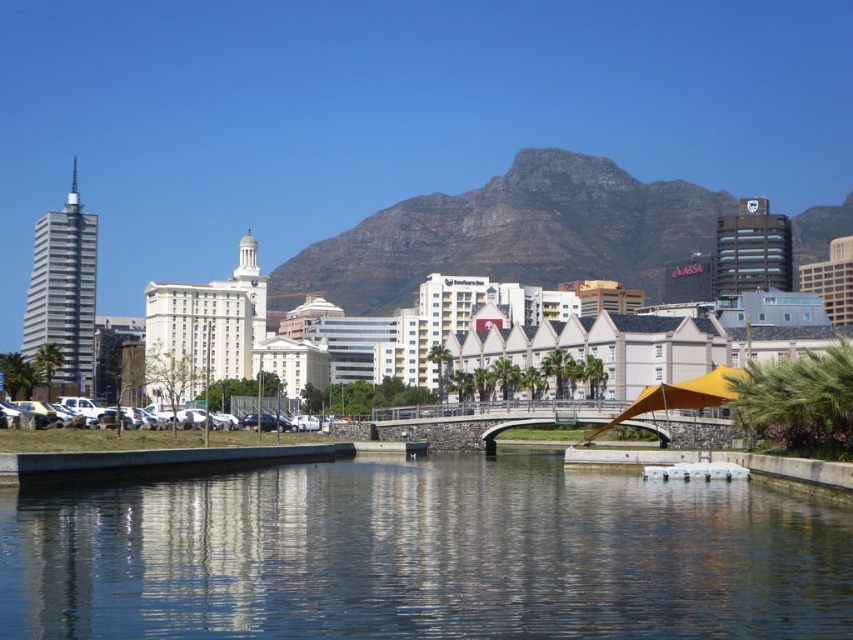
You are standing in the urban landscape scene and want to walk from the point at coordinates point (463, 228) to the point at coordinates point (717, 385). Which direction should you move in relation to your current position?

You should move away from the camera because point (717, 385) is further away than point (463, 228).

You are an architect designing a new sculpture that needs to be placed between the transparent glass water at center and the yellow fabric umbrella at center. The sculpture is 2 meters tall. Can it fit vertically between them without exceeding the height of the shorter object?

The transparent glass water at center is not as tall as yellow fabric umbrella at center, so the shorter object is the transparent glass water at center. Since the sculpture is 2 meters tall, it can only fit if the transparent glass water at center is taller than 2 meters. However, since the description states it is shorter than the umbrella but does not provide exact measurements, we cannot confirm if it meets the requirement. Please provide more details about the height of the transparent glass water at.

What is the object located at the coordinates point (422, 556) in the image?

The point (422, 556) marks transparent glass water at center.